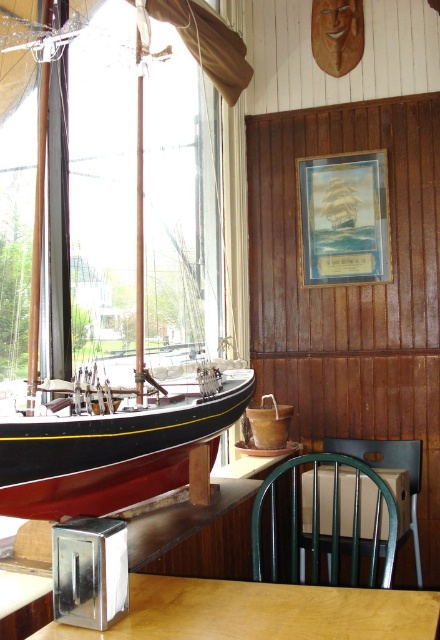
You are standing in the center of the room and want to move towards the black polished wood boat at left. Which direction should you walk to reach it?

Since the black polished wood boat at left is located at point 0.477 on the x and 0.266 on the y axis, you should walk towards the left side of the room to reach it.

You are sitting in the green wooden chair at lower center of the room. Looking up, can you see the wooden table at center from your current position?

Yes, because the wooden table at center is located above the green wooden chair at lower center, so looking up would allow you to see it.

You are a delivery person carrying a large box that is 24 inches wide. You need to place it between the wooden table at center and the green wooden chair at lower center. Can the box fit in the space between them?

A: The wooden table at center and green wooden chair at lower center are 23.49 inches apart from each other, so the box that is 24 inches wide cannot fit between them since the space is slightly narrower than the box.